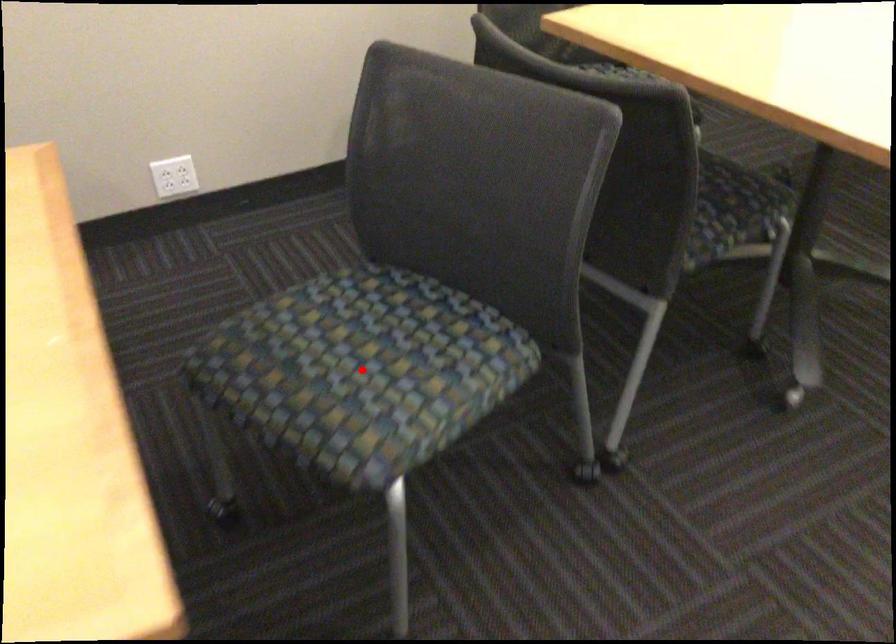
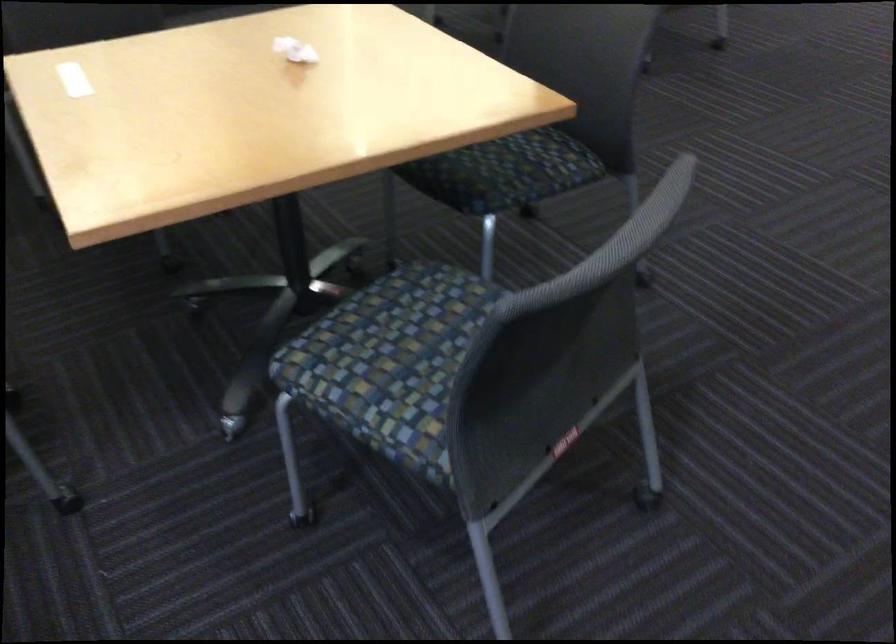
Question: I am providing you with two images of the same scene from different viewpoints. A red point is marked on the first image. At the location where the point appears in image 1, is it still visible in image 2?

Choices:
 (A) Yes
 (B) No

Answer: (B)